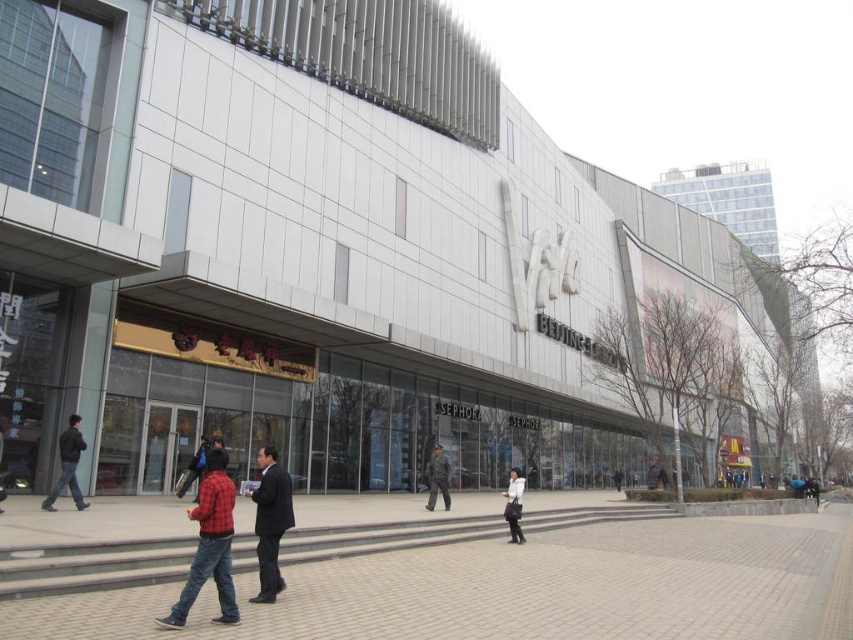
Who is lower down, dark gray jacket at left or white matte jacket at center?

Positioned lower is white matte jacket at center.

Is point (68, 429) more distant than point (509, 506)?

That is False.

Does point (57, 477) come behind point (519, 525)?

Yes, it is.

You are a GUI agent. You are given a task and a screenshot of the screen. Output one action in this format:
    pyautogui.click(x=<x>, y=<y>)
    Task: Click on the dark gray jacket at left
    The height and width of the screenshot is (640, 853).
    Given the screenshot: What is the action you would take?
    pyautogui.click(x=68, y=465)

How far apart are gray concrete pavement at lower left and dark gray uniform at center?

The distance of gray concrete pavement at lower left from dark gray uniform at center is 10.20 meters.

Does point (438, 582) come behind point (445, 506)?

No.

Is point (459, 602) farther from viewer compared to point (434, 445)?

No, it is in front of (434, 445).

Find the location of a particular element. gray concrete pavement at lower left is located at coordinates (521, 588).

This screenshot has height=640, width=853. What do you see at coordinates (521, 588) in the screenshot?
I see `gray concrete pavement at lower left` at bounding box center [521, 588].

Locate an element on the screen. Image resolution: width=853 pixels, height=640 pixels. gray concrete pavement at lower left is located at coordinates (521, 588).